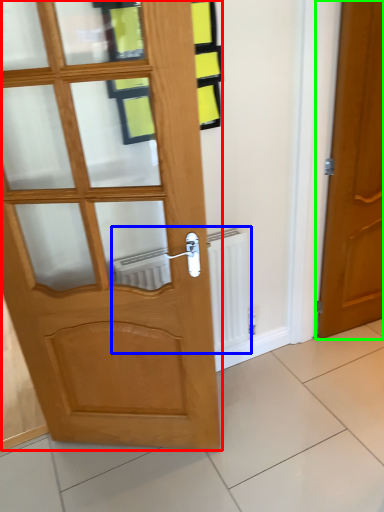
Question: Based on their relative distances, which object is nearer to door (highlighted by a red box)? Choose from radiator (highlighted by a blue box) and door (highlighted by a green box).

Choices:
 (A) radiator
 (B) door

Answer: (A)